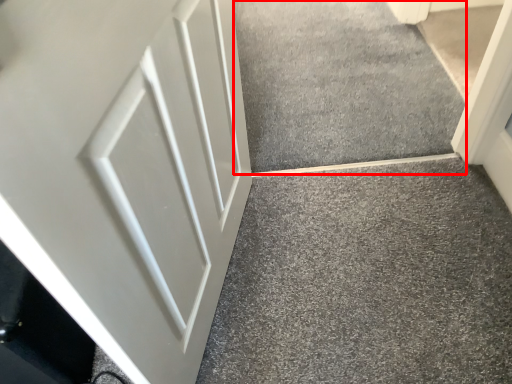
Question: From the image's perspective, what is the correct spatial positioning of concrete (annotated by the red box) in reference to door?

Choices:
 (A) above
 (B) below

Answer: (A)